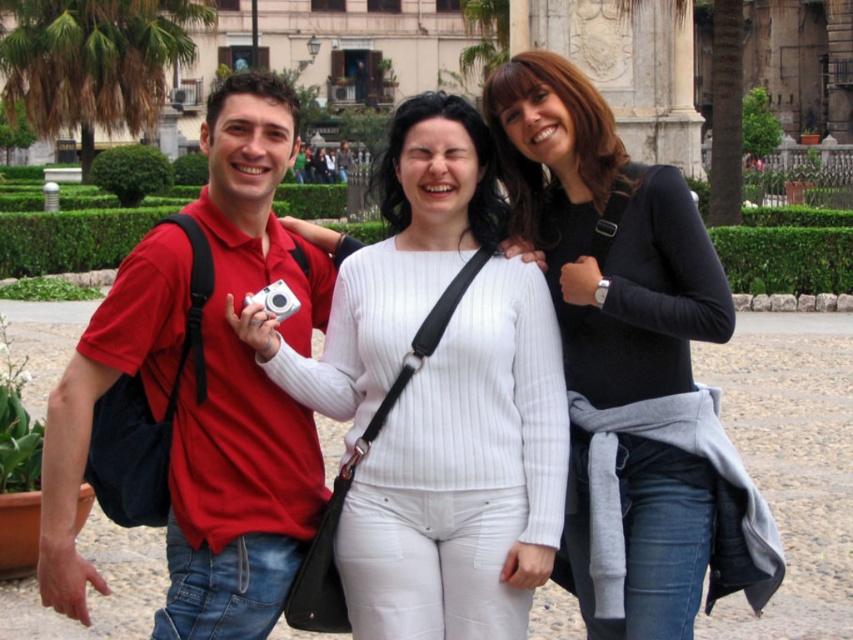
Question: Is white ribbed sweater at center thinner than black matte sweater at center?

Choices:
 (A) yes
 (B) no

Answer: (B)

Question: Is white ribbed sweater at center closer to the viewer compared to black matte sweater at center?

Choices:
 (A) no
 (B) yes

Answer: (A)

Question: Which object is the closest to the silver metallic camera at center?

Choices:
 (A) white ribbed sweater at center
 (B) matte red shirt at center
 (C) black matte sweater at center

Answer: (B)

Question: Which of the following is the closest to the observer?

Choices:
 (A) (229, 604)
 (B) (607, 268)
 (C) (247, 301)

Answer: (A)

Question: Which point is closer to the camera?

Choices:
 (A) matte red shirt at center
 (B) white ribbed sweater at center

Answer: (A)

Question: Can you confirm if matte red shirt at center is positioned to the left of silver metallic camera at center?

Choices:
 (A) no
 (B) yes

Answer: (B)